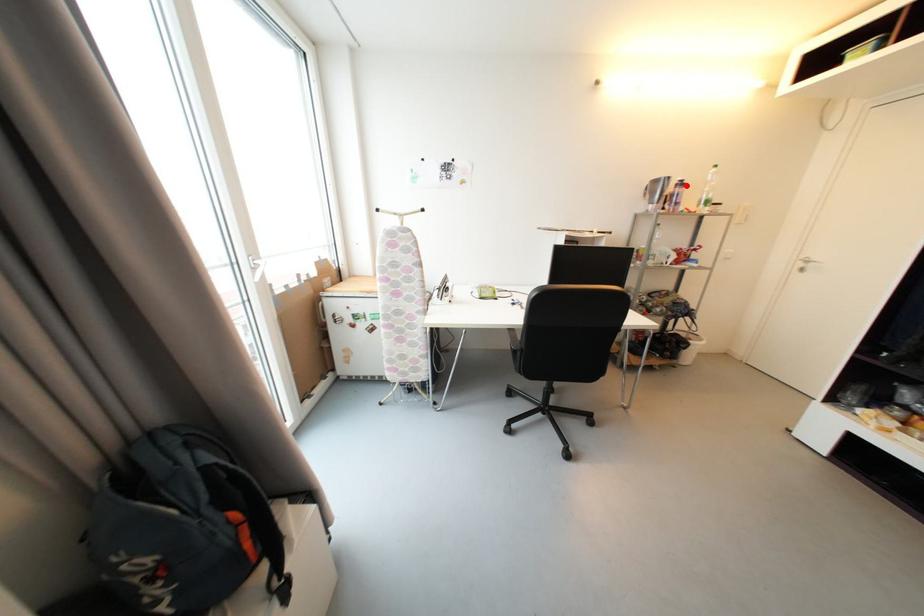
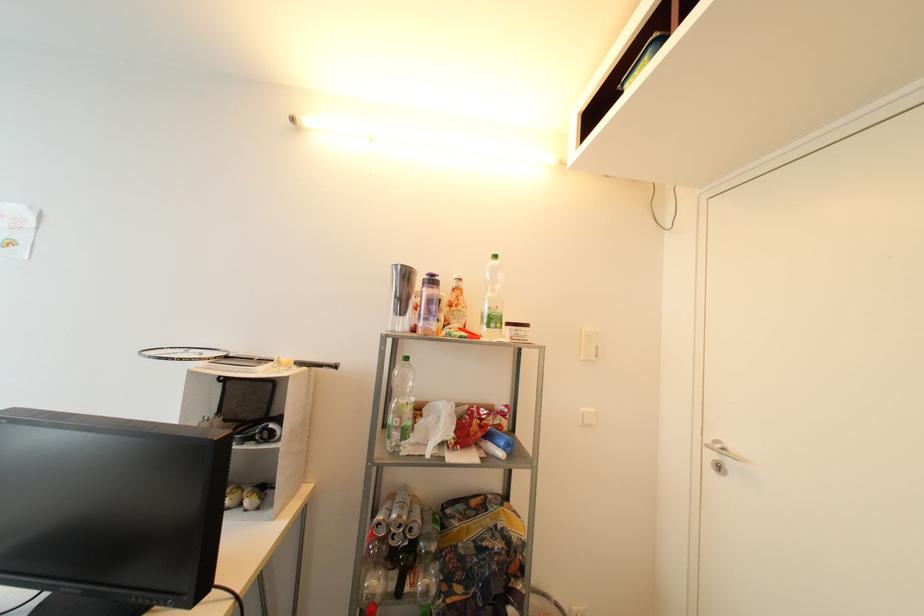
In the second image, find the point that corresponds to the highlighted location in the first image.

(438, 283)